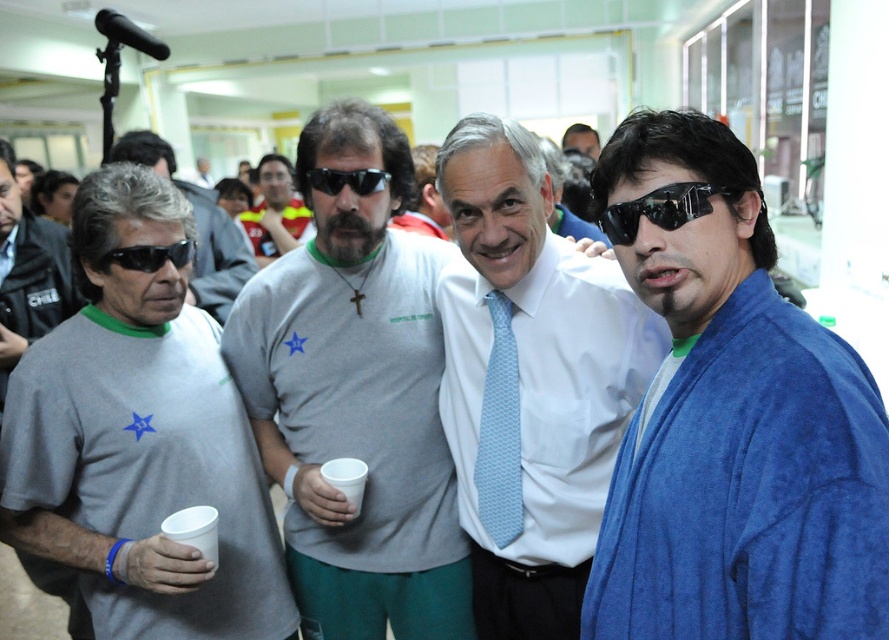
Is light blue textured tie at center further to the viewer compared to black plastic sunglasses at center?

No, it is in front of black plastic sunglasses at center.

Who is more forward, (511, 461) or (373, 182)?

Point (511, 461) is more forward.

The width and height of the screenshot is (889, 640). I want to click on light blue textured tie at center, so click(499, 433).

Find the location of a particular element. light blue textured tie at center is located at coordinates (499, 433).

Who is taller, gray fabric shirt at left or light blue textured tie at center?

Standing taller between the two is gray fabric shirt at left.

Is point (191, 589) farther from viewer compared to point (513, 515)?

No.

Measure the distance between point (252, 637) and camera.

Point (252, 637) and camera are 5.53 feet apart from each other.

Where is `gray fabric shirt at left`? The image size is (889, 640). gray fabric shirt at left is located at coordinates (140, 440).

From the picture: How far apart are blue textured robe at right and matte gray t-shirt at center?

blue textured robe at right and matte gray t-shirt at center are 2.81 meters apart.

Is blue textured robe at right thinner than matte gray t-shirt at center?

Indeed, blue textured robe at right has a lesser width compared to matte gray t-shirt at center.

Is point (581, 593) in front of point (275, 204)?

Yes.

Identify the location of blue textured robe at right. (530, 381).